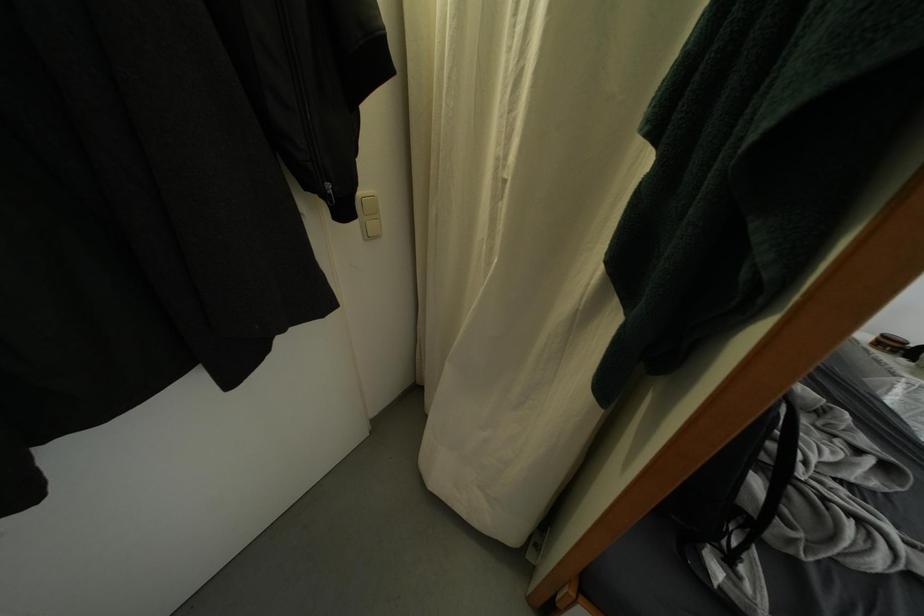
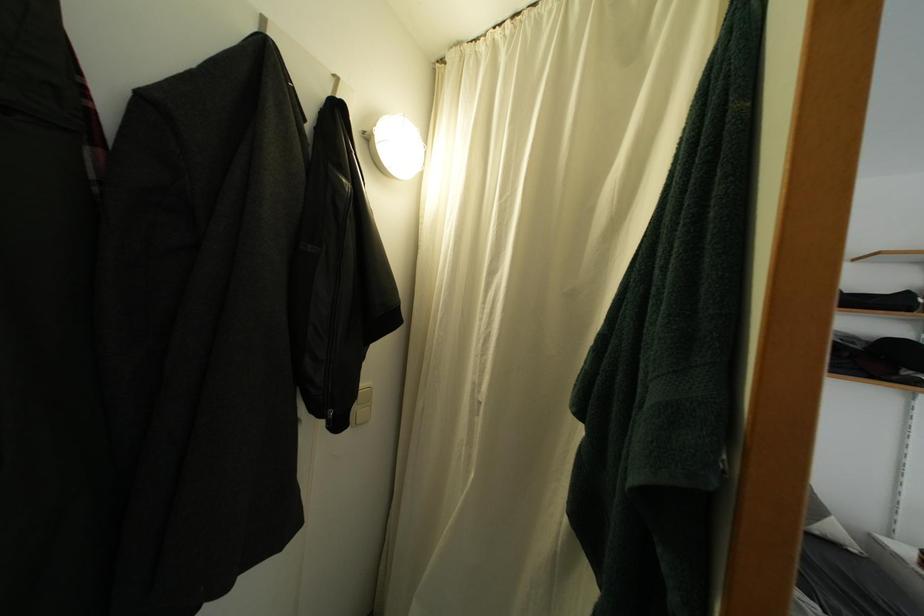
Question: Based on the continuous images, in which direction is the camera rotating? Reply with the corresponding letter.

Choices:
 (A) Left
 (B) Right
 (C) Up
 (D) Down

Answer: (C)